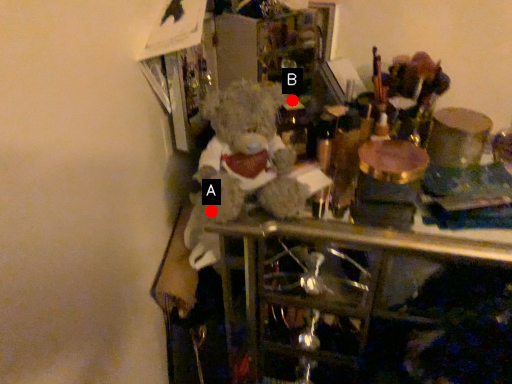
Question: Two points are circled on the image, labeled by A and B beside each circle. Among these points, which one is farthest from the camera?

Choices:
 (A) A is further
 (B) B is further

Answer: (B)